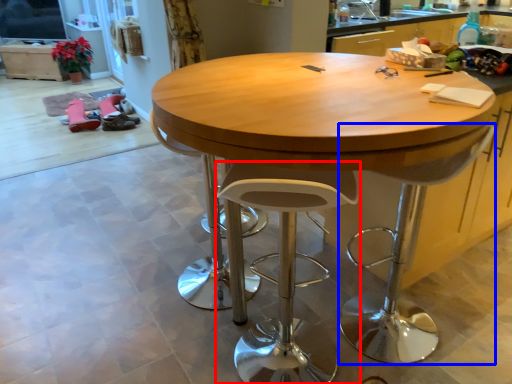
Question: Which point is further to the camera, stool (highlighted by a red box) or swivel chair (highlighted by a blue box)?

Choices:
 (A) stool
 (B) swivel chair

Answer: (B)